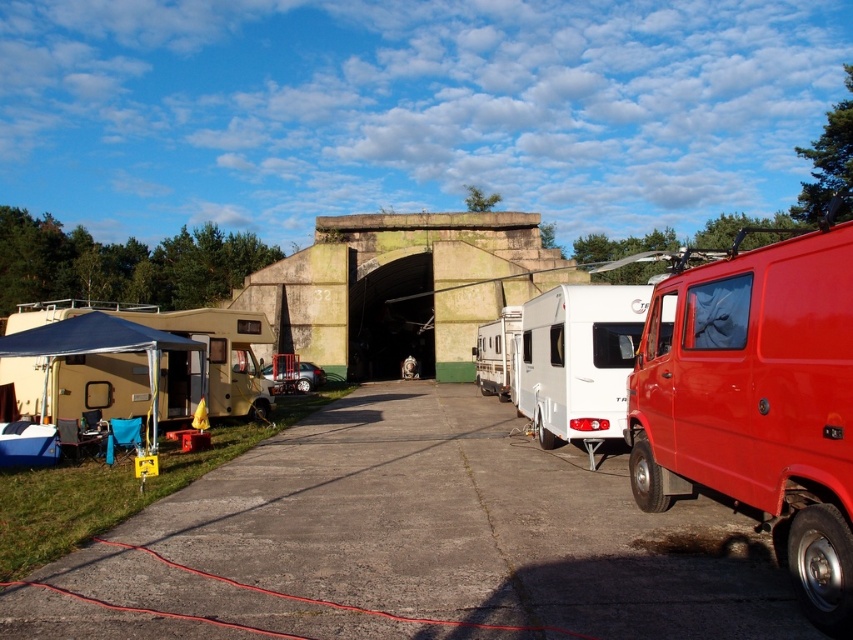
Does shiny red van at right come behind white glossy camper at center?

No, shiny red van at right is closer to the viewer.

Who is lower down, shiny red van at right or white glossy camper at center?

white glossy camper at center

Is point (761, 394) closer to camera compared to point (543, 369)?

Yes, it is.

Image resolution: width=853 pixels, height=640 pixels. I want to click on shiny red van at right, so click(757, 397).